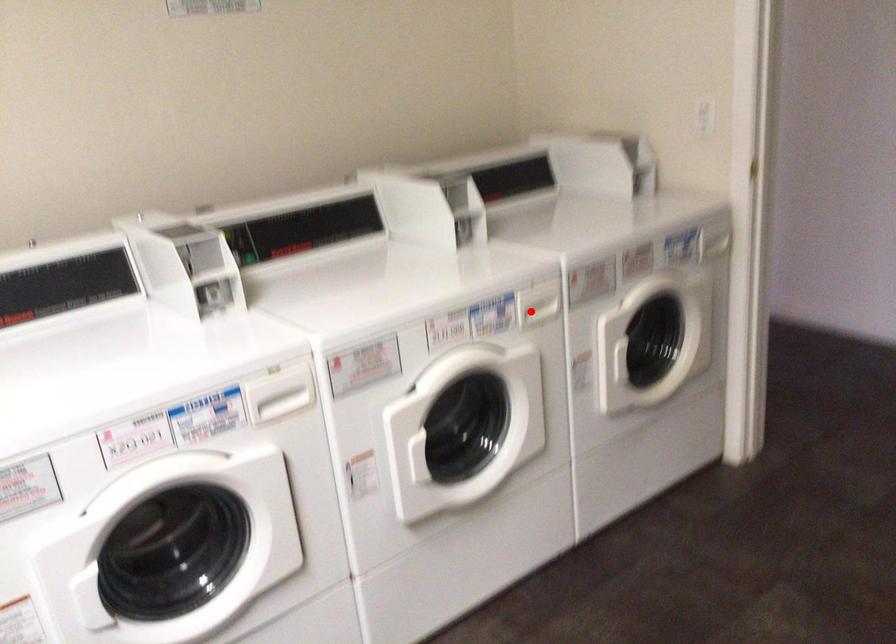
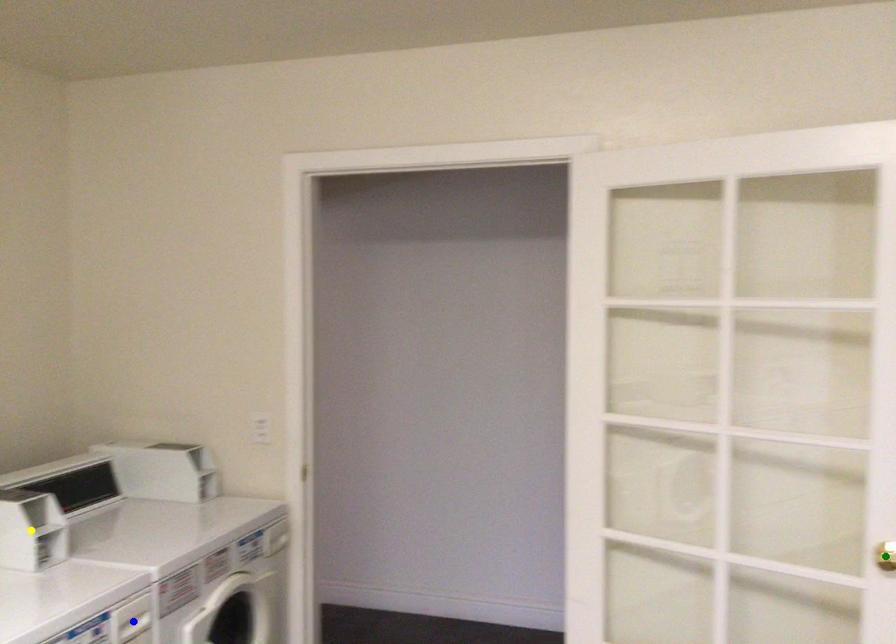
Question: I am providing you with two images of the same scene from different viewpoints. A red point is marked on the first image. You are given multiple points on the second image. Which mark in image 2 goes with the point in image 1?

Choices:
 (A) yellow point
 (B) green point
 (C) blue point

Answer: (C)